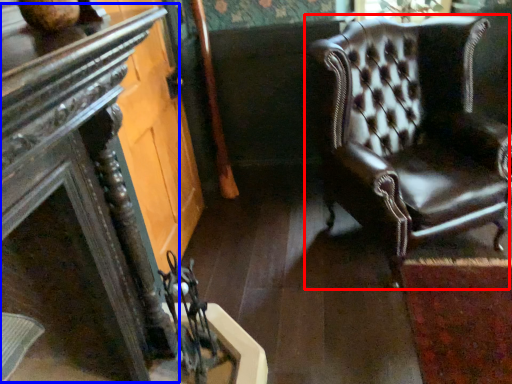
Question: Which point is further to the camera, chair (highlighted by a red box) or table (highlighted by a blue box)?

Choices:
 (A) chair
 (B) table

Answer: (A)